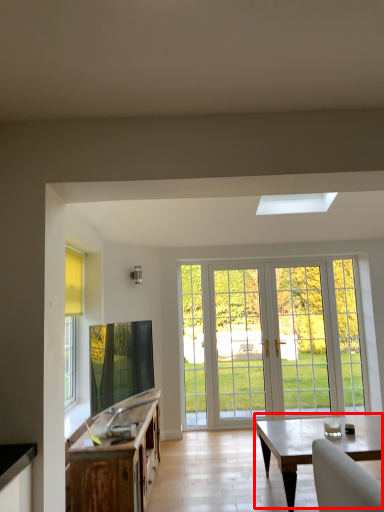
Question: From the image's perspective, what is the correct spatial relationship of coffee table (annotated by the red box) in relation to cabinetry?

Choices:
 (A) below
 (B) above

Answer: (A)